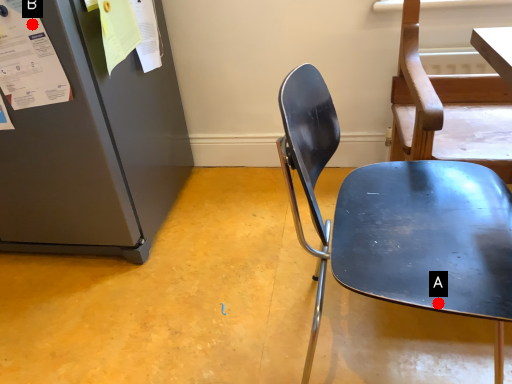
Question: Two points are circled on the image, labeled by A and B beside each circle. Which point is closer to the camera taking this photo?

Choices:
 (A) A is closer
 (B) B is closer

Answer: (A)